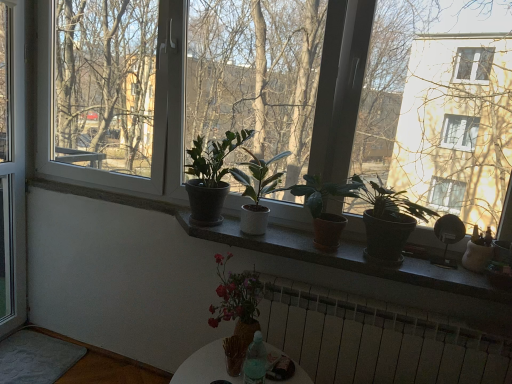
Question: Can you confirm if translucent glass vase at lower center is shorter than brown terracotta pot at center, the 2th houseplant positioned from the right?

Choices:
 (A) yes
 (B) no

Answer: (A)

Question: Does translucent glass vase at lower center have a lesser width compared to brown terracotta pot at center, the 2th houseplant positioned from the right?

Choices:
 (A) yes
 (B) no

Answer: (B)

Question: Is translucent glass vase at lower center aimed at brown terracotta pot at center, the 2th houseplant positioned from the right?

Choices:
 (A) no
 (B) yes

Answer: (A)

Question: Does translucent glass vase at lower center have a greater height compared to brown terracotta pot at center, the 2th houseplant positioned from the right?

Choices:
 (A) no
 (B) yes

Answer: (A)

Question: Does translucent glass vase at lower center come in front of brown terracotta pot at center, positioned as the 4th houseplant in left-to-right order?

Choices:
 (A) no
 (B) yes

Answer: (B)

Question: Could brown terracotta pot at center, the 2th houseplant positioned from the right, be considered to be inside translucent glass vase at lower center?

Choices:
 (A) yes
 (B) no

Answer: (B)

Question: Is pink matte vase at center, positioned as the 4th houseplant in right-to-left order, further to camera compared to soft gray carpet at lower left?

Choices:
 (A) yes
 (B) no

Answer: (B)

Question: From a real-world perspective, is pink matte vase at center, the 2th houseplant when ordered from left to right, located beneath soft gray carpet at lower left?

Choices:
 (A) yes
 (B) no

Answer: (B)

Question: Is pink matte vase at center, the 2th houseplant when ordered from left to right, not within soft gray carpet at lower left?

Choices:
 (A) yes
 (B) no

Answer: (A)

Question: Is pink matte vase at center, positioned as the 4th houseplant in right-to-left order, taller than soft gray carpet at lower left?

Choices:
 (A) no
 (B) yes

Answer: (B)

Question: Considering the relative sizes of pink matte vase at center, the 2th houseplant when ordered from left to right, and soft gray carpet at lower left in the image provided, is pink matte vase at center, the 2th houseplant when ordered from left to right, smaller than soft gray carpet at lower left?

Choices:
 (A) no
 (B) yes

Answer: (A)

Question: Considering the relative sizes of pink matte vase at center, positioned as the 4th houseplant in right-to-left order, and soft gray carpet at lower left in the image provided, is pink matte vase at center, positioned as the 4th houseplant in right-to-left order, thinner than soft gray carpet at lower left?

Choices:
 (A) no
 (B) yes

Answer: (B)

Question: Is matte concrete window sill at center outside of white metallic radiator at lower center?

Choices:
 (A) no
 (B) yes

Answer: (B)